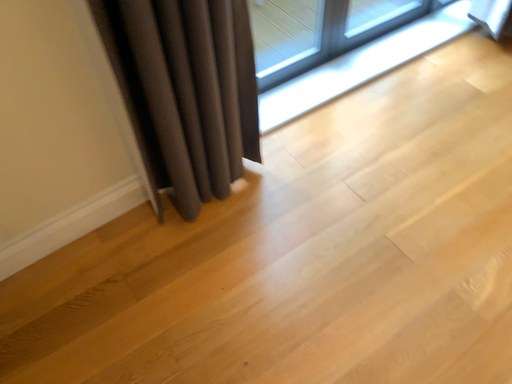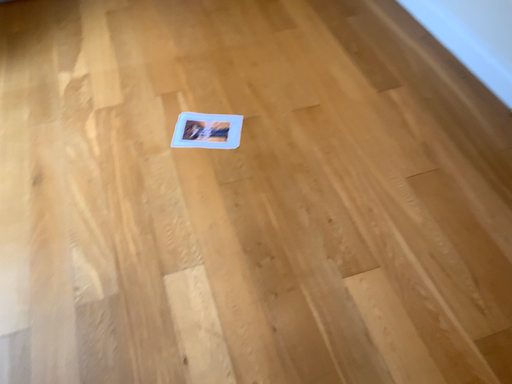
Question: Which way did the camera rotate in the video?

Choices:
 (A) rotated right
 (B) rotated left

Answer: (A)